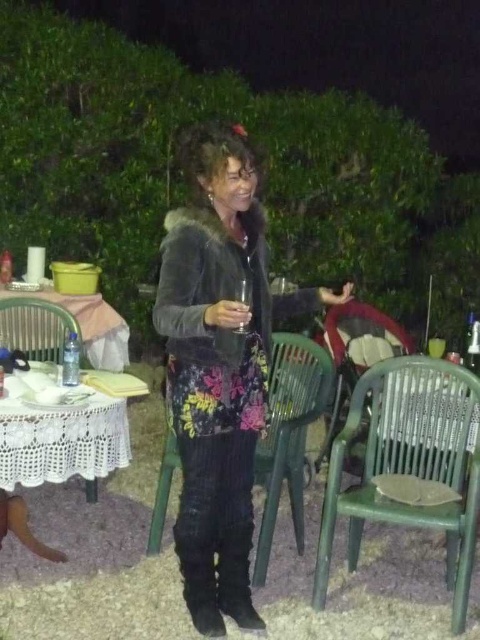
Is green plastic chair at lower right to the left of white lace tablecloth at lower left from the viewer's perspective?

In fact, green plastic chair at lower right is to the right of white lace tablecloth at lower left.

Is green plastic chair at lower right wider than white lace tablecloth at lower left?

Yes, green plastic chair at lower right is wider than white lace tablecloth at lower left.

Measure the distance between green plastic chair at lower right and camera.

green plastic chair at lower right is 2.29 meters from camera.

At what (x,y) coordinates should I click in order to perform the action: click on green plastic chair at lower right. Please return your answer as a coordinate pair (x, y). The image size is (480, 640). Looking at the image, I should click on (410, 465).

Can you confirm if fuzzy gray jacket at center is wider than white lace tablecloth at lower left?

Indeed, fuzzy gray jacket at center has a greater width compared to white lace tablecloth at lower left.

In the scene shown: Is fuzzy gray jacket at center behind white lace tablecloth at lower left?

No, fuzzy gray jacket at center is closer to the viewer.

I want to click on fuzzy gray jacket at center, so click(x=219, y=365).

Which is more to the left, green plastic chair at lower right or green plastic chair at center?

green plastic chair at center

Can you confirm if green plastic chair at lower right is smaller than green plastic chair at center?

No.

The height and width of the screenshot is (640, 480). In order to click on green plastic chair at lower right in this screenshot , I will do `click(410, 465)`.